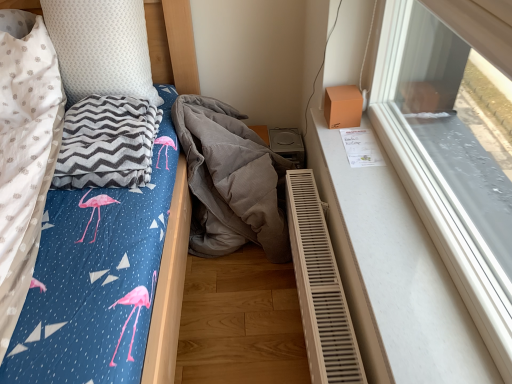
Identify the location of vacant point above beige plastic radiator at lower right (from a real-world perspective). (324, 253).